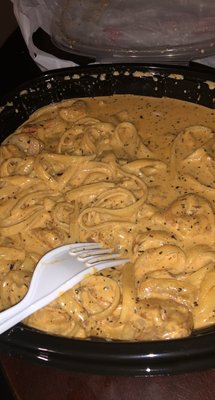
You are a GUI agent. You are given a task and a screenshot of the screen. Output one action in this format:
    pyautogui.click(x=<x>, y=<y>)
    Task: Click on the bowl
    
    Given the screenshot: What is the action you would take?
    pyautogui.click(x=126, y=362)